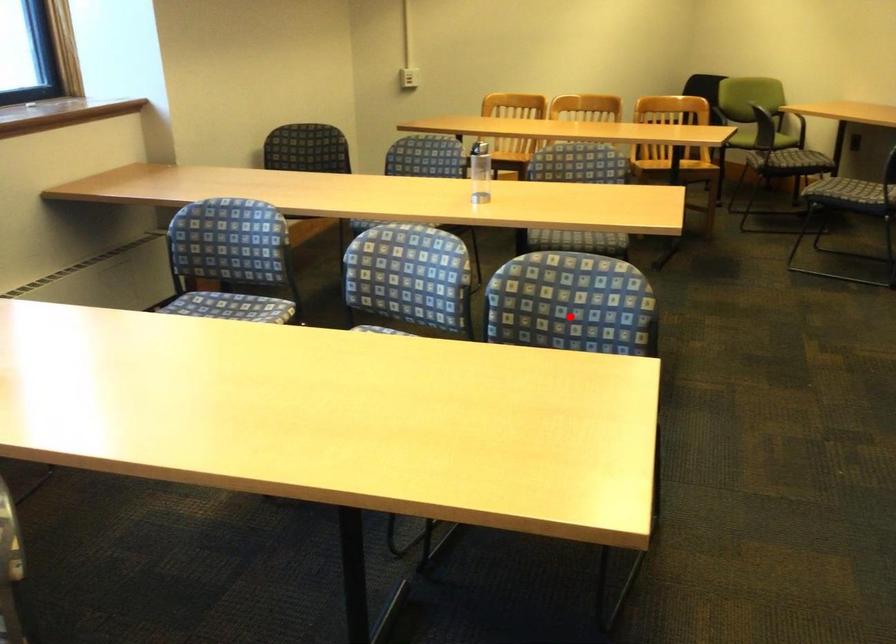
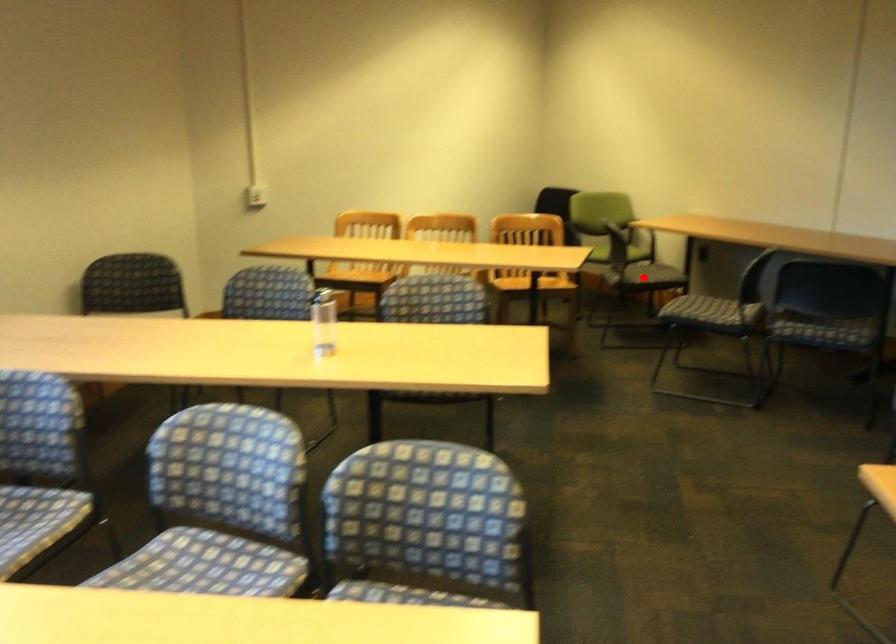
I am providing you with two images of the same scene from different viewpoints. A red point is marked on the first image and another point is marked on the second image. Does the point marked in image1 correspond to the same location as the one in image2?

No